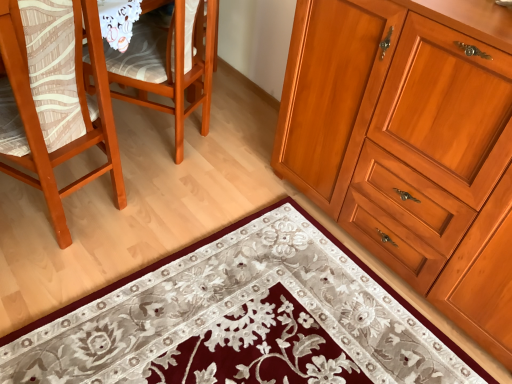
You are a GUI agent. You are given a task and a screenshot of the screen. Output one action in this format:
    pyautogui.click(x=<x>, y=<y>)
    Task: Click on the free location above floral carpet at lower center (from a real-world perspective)
    The image size is (512, 384).
    Given the screenshot: What is the action you would take?
    pyautogui.click(x=249, y=332)